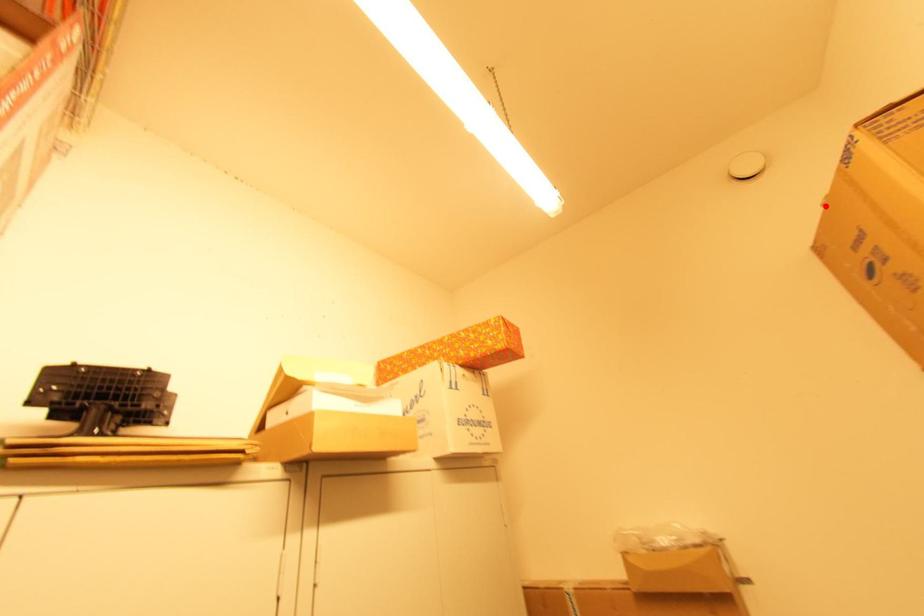
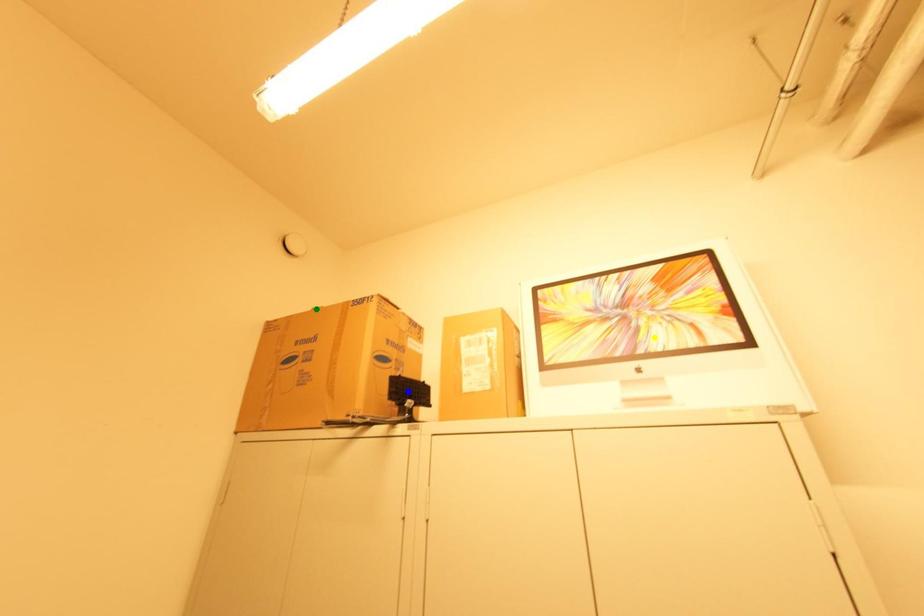
Question: I am providing you with two images of the same scene from different viewpoints. A red point is marked on the first image. You are given multiple points on the second image. In image 2, which mark is for the same physical point as the one in image 1?

Choices:
 (A) green point
 (B) yellow point
 (C) blue point

Answer: (A)